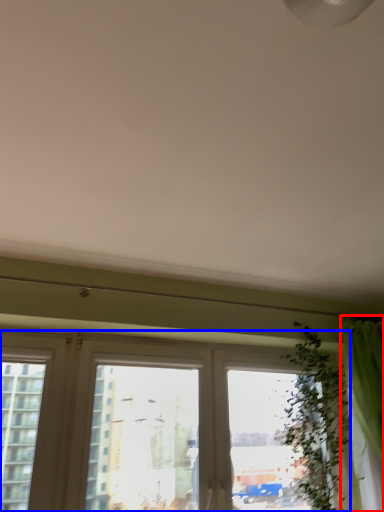
Question: Among these objects, which one is farthest to the camera, curtain (highlighted by a red box) or window (highlighted by a blue box)?

Choices:
 (A) curtain
 (B) window

Answer: (A)